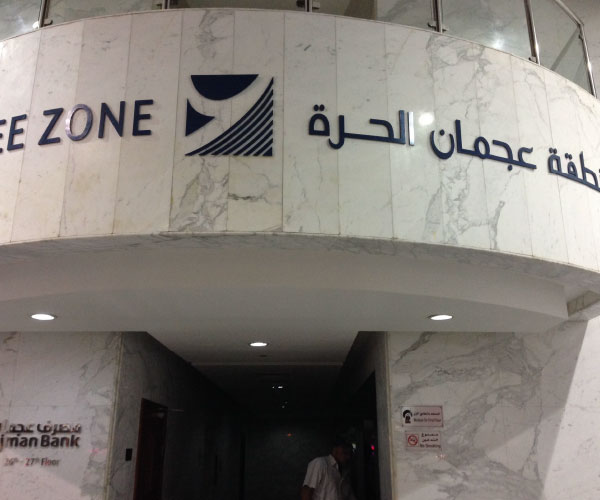
The height and width of the screenshot is (500, 600). I want to click on light on wall, so click(280, 388).